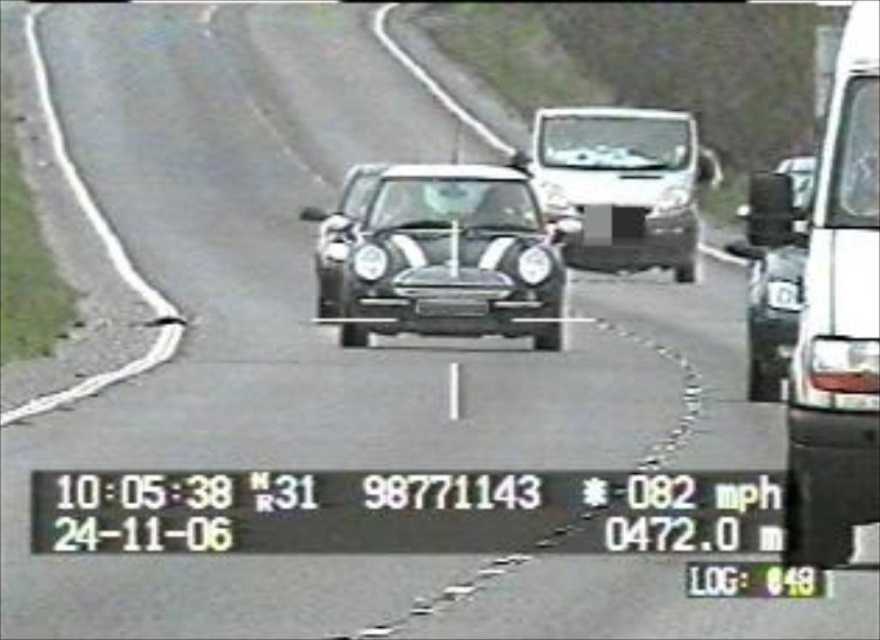
You are a traffic officer checking if the white matte van at right is blocking the black plastic license plate at center from being visible. Based on their positions, can the license plate be seen clearly?

The white matte van at right is in front of the black plastic license plate at center, so it is blocking the license plate and making it not visible clearly.

You are a delivery driver who needs to park your vehicle between the white matte van at right and the white glossy van at center. Based on their heights, which van should you position your vehicle closer to?

You should position your vehicle closer to the white matte van at right because it is shorter than the white glossy van at center, providing more vertical clearance.

Based on the photo, you are a traffic officer analyzing a road surveillance image. You notice a white glossy truck at right and a black plastic license plate at center. Which object is positioned more to the right side of the image?

The white glossy truck at right is positioned more to the right side of the image than the black plastic license plate at center.